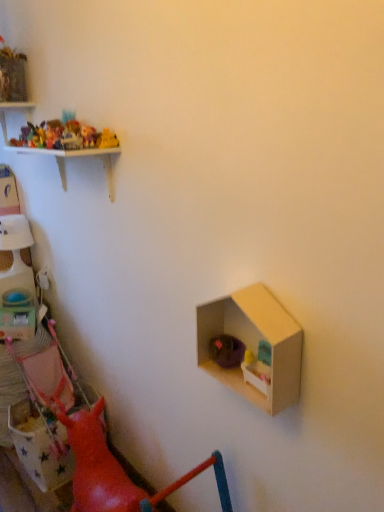
Question: From the image's perspective, would you say matte plastic toy box at left is positioned over plastic toys at upper left, which appears as the 2th toy when viewed from the back?

Choices:
 (A) yes
 (B) no

Answer: (B)

Question: Would you consider matte plastic toy box at left to be distant from plastic toys at upper left, the fourth toy positioned from the right?

Choices:
 (A) yes
 (B) no

Answer: (B)

Question: Considering the relative sizes of matte plastic toy box at left and plastic toys at upper left, the third toy when ordered from front to back, in the image provided, is matte plastic toy box at left taller than plastic toys at upper left, the third toy when ordered from front to back,?

Choices:
 (A) no
 (B) yes

Answer: (B)

Question: From a real-world perspective, is matte plastic toy box at left over plastic toys at upper left, which is the second toy in top-to-bottom order?

Choices:
 (A) yes
 (B) no

Answer: (B)

Question: Considering the relative positions of matte plastic toy box at left and plastic toys at upper left, arranged as the 3th toy when ordered from the bottom, in the image provided, is matte plastic toy box at left to the right of plastic toys at upper left, arranged as the 3th toy when ordered from the bottom, from the viewer's perspective?

Choices:
 (A) yes
 (B) no

Answer: (B)

Question: Is the position of matte plastic toy box at left more distant than that of plastic toys at upper left, the third toy when ordered from front to back?

Choices:
 (A) yes
 (B) no

Answer: (A)

Question: Is plastic toys at upper left, which is the second toy in top-to-bottom order, to the right of matte plastic toy box at left from the viewer's perspective?

Choices:
 (A) no
 (B) yes

Answer: (B)

Question: Is plastic toys at upper left, arranged as the 3th toy when ordered from the bottom, wider than matte plastic toy box at left?

Choices:
 (A) no
 (B) yes

Answer: (A)

Question: From the image's perspective, is plastic toys at upper left, arranged as the 3th toy when ordered from the bottom, located beneath matte plastic toy box at left?

Choices:
 (A) no
 (B) yes

Answer: (A)

Question: Is plastic toys at upper left, which is the second toy in top-to-bottom order, completely or partially outside of matte plastic toy box at left?

Choices:
 (A) no
 (B) yes

Answer: (B)

Question: Is plastic toys at upper left, arranged as the 3th toy when ordered from the bottom, closer to camera compared to matte plastic toy box at left?

Choices:
 (A) yes
 (B) no

Answer: (A)

Question: Is plastic toys at upper left, arranged as the 3th toy when ordered from the bottom, in contact with matte plastic toy box at left?

Choices:
 (A) yes
 (B) no

Answer: (B)

Question: Is matte cardboard dollhouse at center right touching purple fabric basket at lower right, which is the 1th toy from bottom to top?

Choices:
 (A) no
 (B) yes

Answer: (A)